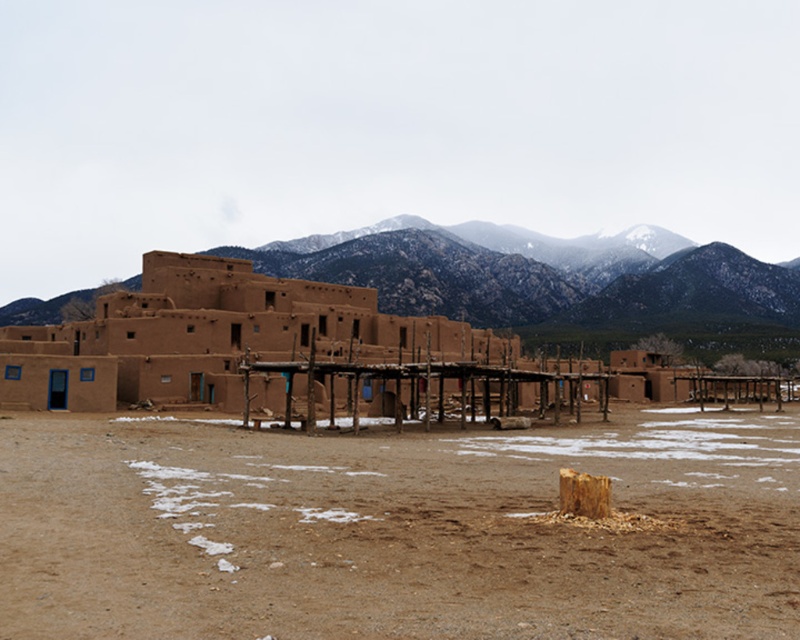
Question: Among these points, which one is nearest to the camera?

Choices:
 (A) (228, 323)
 (B) (724, 547)
 (C) (388, 312)

Answer: (B)

Question: Estimate the real-world distances between objects in this image. Which object is closer to the adobe at center?

Choices:
 (A) brown sandy dirt at center
 (B) snow-covered rock formation at center

Answer: (A)

Question: Is the position of snow-covered rock formation at center more distant than that of adobe at center?

Choices:
 (A) no
 (B) yes

Answer: (B)

Question: Is snow-covered rock formation at center in front of adobe at center?

Choices:
 (A) yes
 (B) no

Answer: (B)

Question: Observing the image, what is the correct spatial positioning of brown sandy dirt at center in reference to adobe at center?

Choices:
 (A) above
 (B) below

Answer: (B)

Question: Among these points, which one is farthest from the camera?

Choices:
 (A) (417, 337)
 (B) (712, 531)
 (C) (792, 333)

Answer: (C)